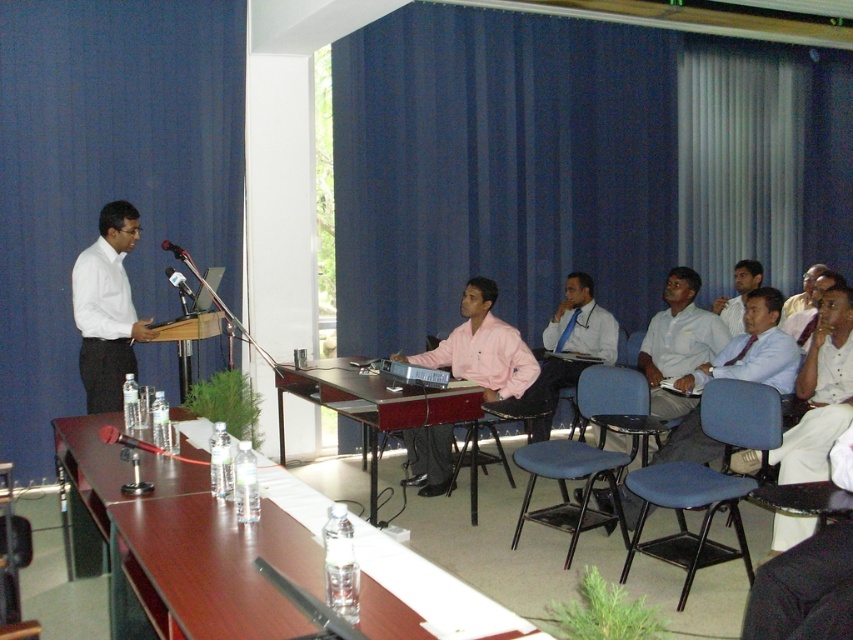
Question: Which of the following is the farthest from the observer?

Choices:
 (A) (192, 292)
 (B) (471, 424)

Answer: (A)

Question: In this image, where is brown wood table at center located relative to light pink shirt at center?

Choices:
 (A) above
 (B) below

Answer: (B)

Question: Can you confirm if blue plastic chair at lower right is bigger than metallic/matte microphone at center?

Choices:
 (A) no
 (B) yes

Answer: (B)

Question: Which object is farther from the camera taking this photo?

Choices:
 (A) brown wooden table at center
 (B) blue plastic chair at center
 (C) brown wood table at center
 (D) black plastic microphone at center

Answer: (D)

Question: Does blue plastic chair at lower right have a smaller size compared to light pink shirt at center?

Choices:
 (A) no
 (B) yes

Answer: (A)

Question: Which point is closer to the camera?

Choices:
 (A) brown wooden table at center
 (B) metallic/matte microphone at center
 (C) blue fabric chair at center
 (D) light pink shirt at center

Answer: (C)